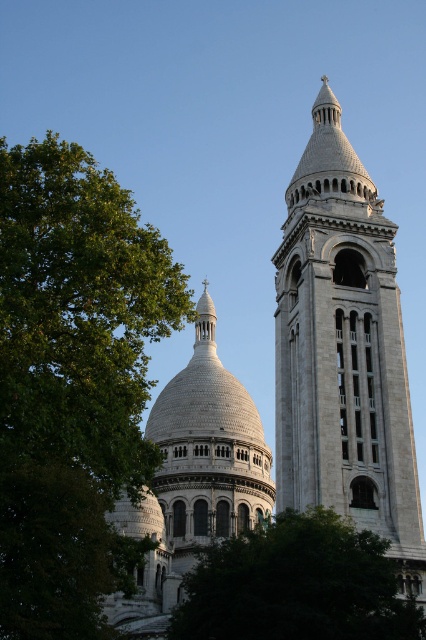
You are standing in front of the cathedral and want to take a photo that includes both the white stone tower at upper center and the white stone dome at center. Which one should you adjust your camera angle to focus on first to ensure both are in frame?

A: Since the white stone tower at upper center is closer to the viewer than the white stone dome at center, you should focus on the white stone tower at upper center first to ensure both are in frame.

You are an architect analyzing the cathedral layout. You need to determine the spatial relationship between the white stone tower at upper center and the white stone dome at center. Based on the scene, which object is located to the right of the other?

The white stone tower at upper center is positioned on the right side of the white stone dome at center.